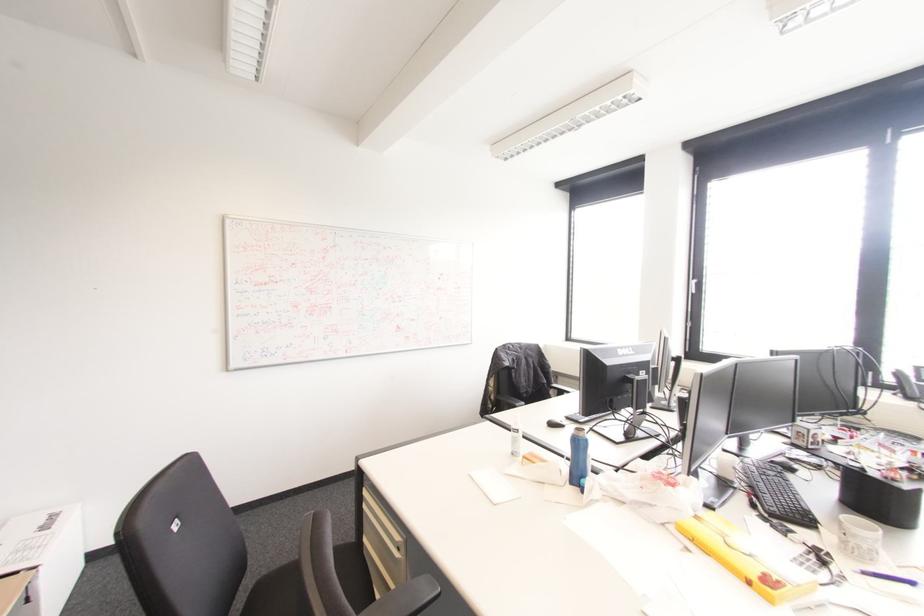
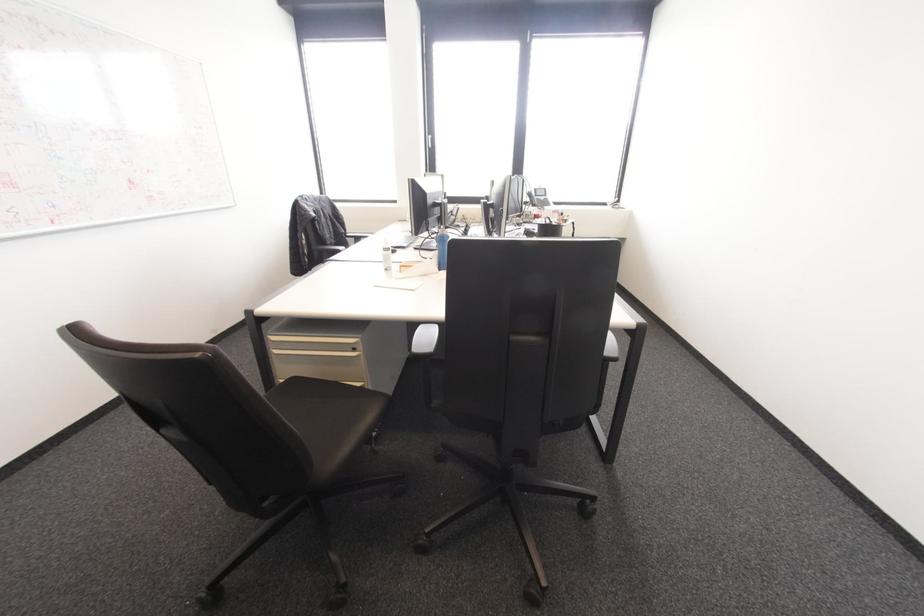
In the second image, find the point that corresponds to pixel 570 482 in the first image.

(440, 270)